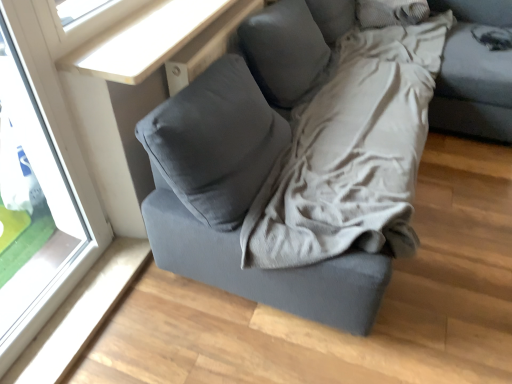
Question: From a real-world perspective, is transparent glass window at upper left located beneath gray fabric pillow at upper right?

Choices:
 (A) no
 (B) yes

Answer: (B)

Question: Considering the relative sizes of transparent glass window at upper left and gray fabric pillow at upper right in the image provided, is transparent glass window at upper left taller than gray fabric pillow at upper right?

Choices:
 (A) yes
 (B) no

Answer: (A)

Question: Is transparent glass window at upper left facing away from gray fabric pillow at upper right?

Choices:
 (A) yes
 (B) no

Answer: (B)

Question: Does transparent glass window at upper left have a lesser width compared to gray fabric pillow at upper right?

Choices:
 (A) yes
 (B) no

Answer: (A)

Question: Are transparent glass window at upper left and gray fabric pillow at upper right far apart?

Choices:
 (A) no
 (B) yes

Answer: (B)

Question: Considering the relative positions of transparent glass window at upper left and gray fabric pillow at upper right in the image provided, is transparent glass window at upper left to the right of gray fabric pillow at upper right from the viewer's perspective?

Choices:
 (A) yes
 (B) no

Answer: (B)

Question: Is the surface of gray fabric pillow at upper right in direct contact with transparent glass window at upper left?

Choices:
 (A) yes
 (B) no

Answer: (B)

Question: Is gray fabric pillow at upper right at the right side of transparent glass window at upper left?

Choices:
 (A) no
 (B) yes

Answer: (B)

Question: Is gray fabric pillow at upper right far away from transparent glass window at upper left?

Choices:
 (A) yes
 (B) no

Answer: (A)

Question: Is gray fabric pillow at upper right facing towards transparent glass window at upper left?

Choices:
 (A) no
 (B) yes

Answer: (B)

Question: Is transparent glass window at upper left located within gray fabric pillow at upper right?

Choices:
 (A) yes
 (B) no

Answer: (B)

Question: Can you confirm if gray fabric pillow at upper right is thinner than transparent glass window at upper left?

Choices:
 (A) yes
 (B) no

Answer: (B)

Question: Which is correct: transparent glass window at upper left is inside gray fabric pillow at upper right, or outside of it?

Choices:
 (A) outside
 (B) inside

Answer: (A)